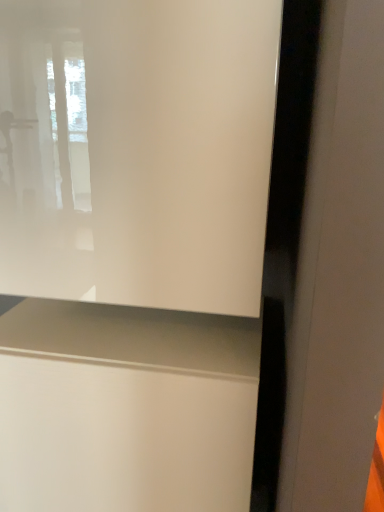
Question: Is point (97, 309) positioned closer to the camera than point (251, 204)?

Choices:
 (A) farther
 (B) closer

Answer: (A)

Question: Considering the positions of matte white vanity at lower center and transparent glass window at upper left in the image, is matte white vanity at lower center wider or thinner than transparent glass window at upper left?

Choices:
 (A) thin
 (B) wide

Answer: (B)

Question: Is matte white vanity at lower center in front of or behind transparent glass window at upper left in the image?

Choices:
 (A) front
 (B) behind

Answer: (B)

Question: Is transparent glass window at upper left taller or shorter than matte white vanity at lower center?

Choices:
 (A) short
 (B) tall

Answer: (A)

Question: From the image's perspective, is transparent glass window at upper left above or below matte white vanity at lower center?

Choices:
 (A) above
 (B) below

Answer: (A)

Question: Is transparent glass window at upper left to the left or to the right of matte white vanity at lower center in the image?

Choices:
 (A) left
 (B) right

Answer: (B)

Question: Does point (89, 188) appear closer or farther from the camera than point (223, 475)?

Choices:
 (A) closer
 (B) farther

Answer: (A)